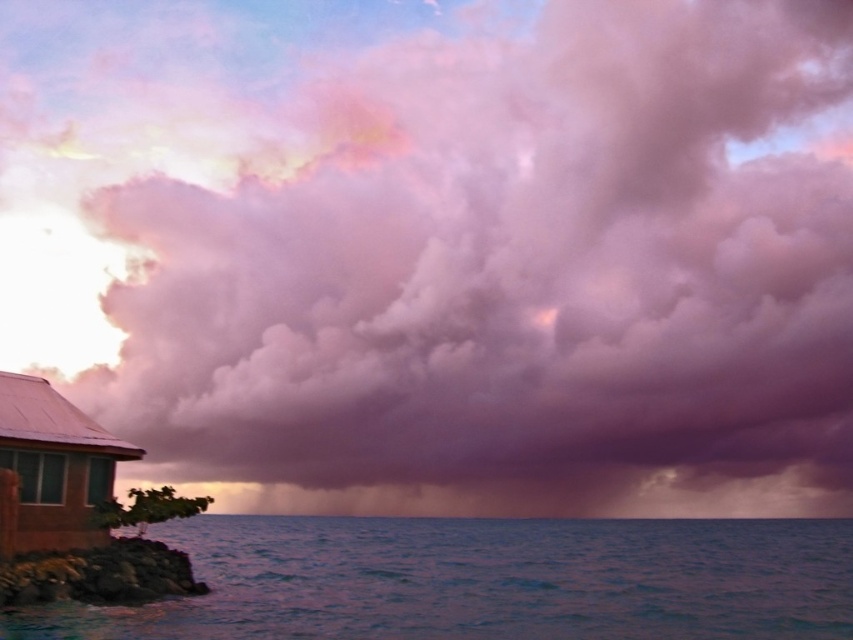
You are standing at the edge of the coast and see the blue water at lower left and the brown corrugated metal hut at lower left. Which object is closer to you?

The blue water at lower left is closer to you because it is in front of the brown corrugated metal hut at lower left.

You are a photographer standing at the edge of the cliff overlooking the ocean. You want to capture the blue water at lower left in your shot. Based on its coordinates, where exactly should you position your camera to ensure it is centered in the frame?

The blue water at lower left is located at coordinates point (486, 580). To center it in your frame, position your camera so that the crosshairs align with these coordinates.